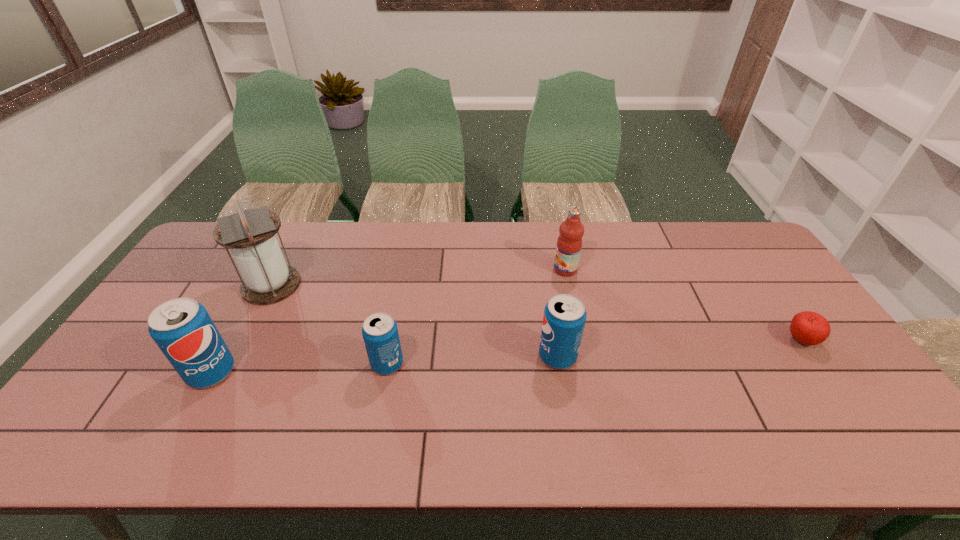
Identify the location of free spot located on the back of the shortest soda can. (408, 258).

Where is `free spot located 0.090m on the back of the second shortest soda can`? Image resolution: width=960 pixels, height=540 pixels. free spot located 0.090m on the back of the second shortest soda can is located at coordinates (551, 318).

Locate an element on the screen. This screenshot has width=960, height=540. free space located on the left of the rightmost object is located at coordinates (723, 341).

Where is `vacant space located 0.220m on the front label of the fruit juice`? Image resolution: width=960 pixels, height=540 pixels. vacant space located 0.220m on the front label of the fruit juice is located at coordinates (486, 269).

Locate an element on the screen. Image resolution: width=960 pixels, height=540 pixels. vacant region located 0.120m on the front label of the fruit juice is located at coordinates (516, 269).

Identify the location of vacant region located on the front label of the fruit juice. (511, 269).

This screenshot has width=960, height=540. What are the coordinates of `vacant space positioned on the front of the tallest object` in the screenshot? It's located at (236, 355).

The height and width of the screenshot is (540, 960). I want to click on object at the far edge, so click(569, 243).

I want to click on object that is positioned at the near edge, so [x=182, y=328].

At what (x,y) coordinates should I click in order to perform the action: click on object positioned at the right edge. Please return your answer as a coordinate pair (x, y). The image size is (960, 540). Looking at the image, I should click on (810, 328).